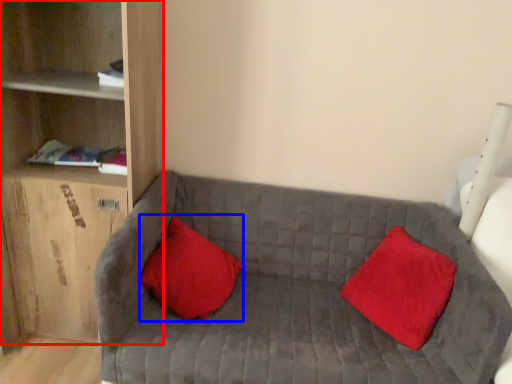
Question: Among these objects, which one is nearest to the camera, shelf (highlighted by a red box) or pillow (highlighted by a blue box)?

Choices:
 (A) shelf
 (B) pillow

Answer: (A)